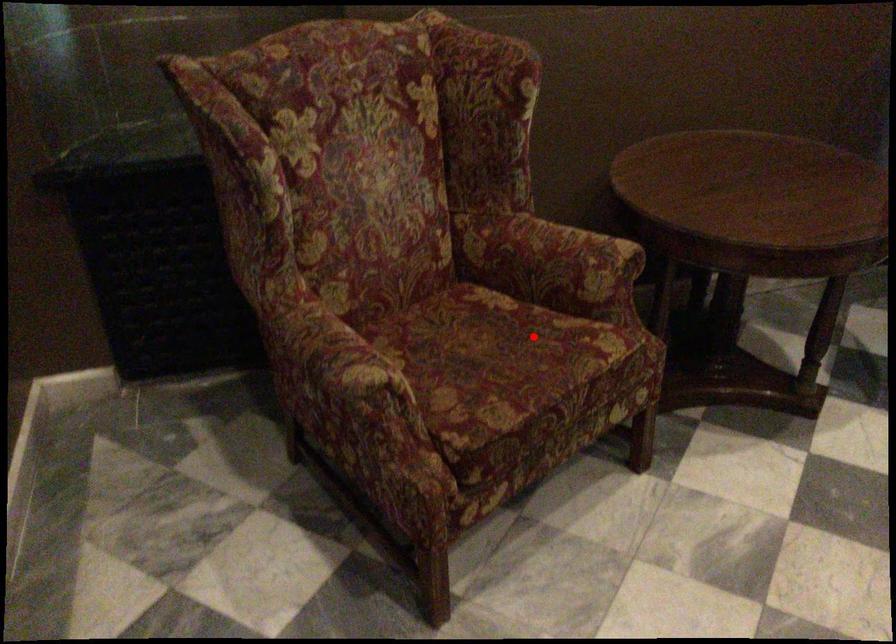
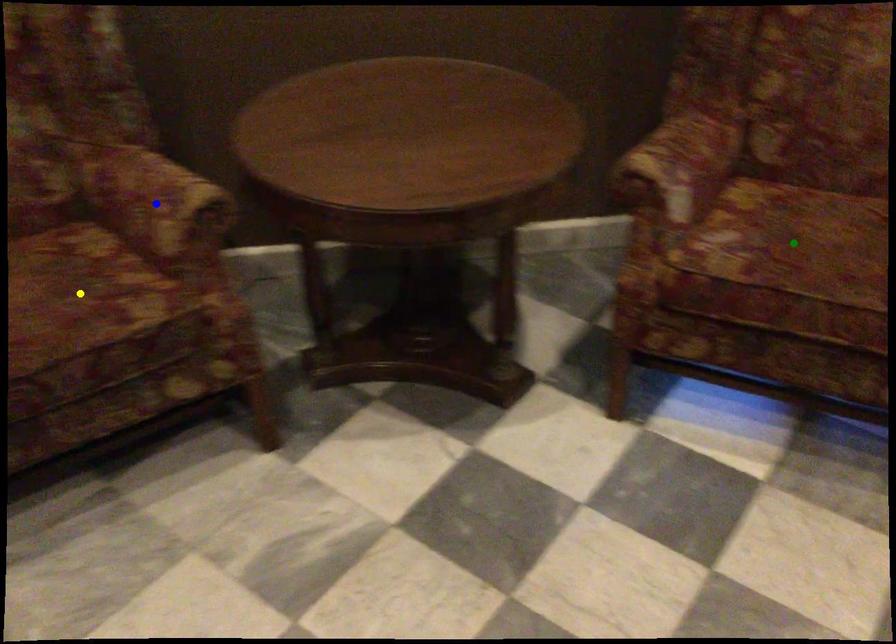
Question: I am providing you with two images of the same scene from different viewpoints. A red point is marked on the first image. You are given multiple points on the second image. Which point in image 2 is actually the same real-world point as the red point in image 1?

Choices:
 (A) blue point
 (B) green point
 (C) yellow point

Answer: (C)